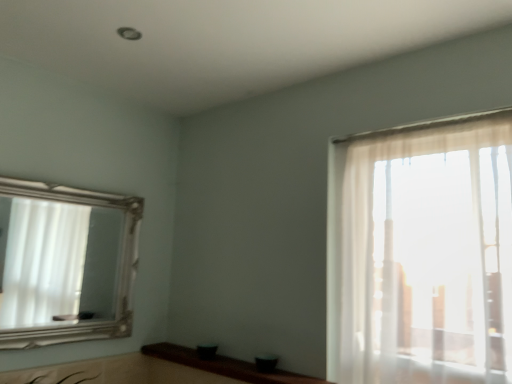
Measure the distance between point [253,374] and camera.

Point [253,374] is 1.66 meters from camera.

Describe the element at coordinates (225, 366) in the screenshot. I see `brown wood counter top at lower center` at that location.

You are a GUI agent. You are given a task and a screenshot of the screen. Output one action in this format:
    pyautogui.click(x=<x>, y=<y>)
    Task: Click on the brown wood counter top at lower center
    
    Given the screenshot: What is the action you would take?
    pyautogui.click(x=225, y=366)

In order to face silver/golden frame mirror at left, should I rotate leftwards or rightwards?

Turn left approximately 22.949 degrees to face it.

Describe the element at coordinates (57, 260) in the screenshot. I see `silver/golden frame mirror at left` at that location.

Image resolution: width=512 pixels, height=384 pixels. Find the location of `silver/golden frame mirror at left`. silver/golden frame mirror at left is located at coordinates (57, 260).

Measure the distance between silver/golden frame mirror at left and camera.

The distance of silver/golden frame mirror at left from camera is 2.51 meters.

Find the location of a particular element. brown wood counter top at lower center is located at coordinates click(x=225, y=366).

Which is more to the left, silver/golden frame mirror at left or brown wood counter top at lower center?

Positioned to the left is silver/golden frame mirror at left.

Relative to brown wood counter top at lower center, is silver/golden frame mirror at left in front or behind?

Clearly, silver/golden frame mirror at left is behind brown wood counter top at lower center.

Considering the points (108, 313) and (165, 349), which point is in front, point (108, 313) or point (165, 349)?

The point (165, 349) is in front.

Looking at this image, from the image's perspective, between silver/golden frame mirror at left and brown wood counter top at lower center, which one is located above?

silver/golden frame mirror at left.

From a real-world perspective, is silver/golden frame mirror at left on brown wood counter top at lower center?

Indeed, from a real-world perspective, silver/golden frame mirror at left stands above brown wood counter top at lower center.

Can you confirm if silver/golden frame mirror at left is wider than brown wood counter top at lower center?

Incorrect, the width of silver/golden frame mirror at left does not surpass that of brown wood counter top at lower center.

Considering the sizes of silver/golden frame mirror at left and brown wood counter top at lower center in the image, is silver/golden frame mirror at left taller or shorter than brown wood counter top at lower center?

In the image, silver/golden frame mirror at left appears to be taller than brown wood counter top at lower center.

Considering the relative sizes of silver/golden frame mirror at left and brown wood counter top at lower center in the image provided, is silver/golden frame mirror at left bigger than brown wood counter top at lower center?

Yes.

Looking at this image, is silver/golden frame mirror at left inside or outside of brown wood counter top at lower center?

silver/golden frame mirror at left is not enclosed by brown wood counter top at lower center.

Is silver/golden frame mirror at left far from brown wood counter top at lower center?

silver/golden frame mirror at left is far away from brown wood counter top at lower center.

Is silver/golden frame mirror at left positioned with its back to brown wood counter top at lower center?

No, silver/golden frame mirror at left's orientation is not away from brown wood counter top at lower center.

Can you tell me how much silver/golden frame mirror at left and brown wood counter top at lower center differ in facing direction?

There is a 89-degree angle between the facing directions of silver/golden frame mirror at left and brown wood counter top at lower center.

Where is `counter top lying in front of the silver/golden frame mirror at left`? The height and width of the screenshot is (384, 512). counter top lying in front of the silver/golden frame mirror at left is located at coordinates (225, 366).

Does brown wood counter top at lower center appear on the right side of silver/golden frame mirror at left?

Indeed, brown wood counter top at lower center is positioned on the right side of silver/golden frame mirror at left.

Between brown wood counter top at lower center and silver/golden frame mirror at left, which one is positioned in front?

brown wood counter top at lower center is more forward.

Is point (249, 375) behind point (61, 242)?

No.

From the image's perspective, is brown wood counter top at lower center located above silver/golden frame mirror at left?

Actually, brown wood counter top at lower center appears below silver/golden frame mirror at left in the image.

From a real-world perspective, is brown wood counter top at lower center above or below silver/golden frame mirror at left?

brown wood counter top at lower center is situated lower than silver/golden frame mirror at left in the real world.

In terms of width, does brown wood counter top at lower center look wider or thinner when compared to silver/golden frame mirror at left?

Considering their sizes, brown wood counter top at lower center looks broader than silver/golden frame mirror at left.

Can you confirm if brown wood counter top at lower center is shorter than silver/golden frame mirror at left?

Yes.

Considering the sizes of objects brown wood counter top at lower center and silver/golden frame mirror at left in the image provided, who is bigger, brown wood counter top at lower center or silver/golden frame mirror at left?

With larger size is silver/golden frame mirror at left.

Does brown wood counter top at lower center contain silver/golden frame mirror at left?

No, brown wood counter top at lower center does not contain silver/golden frame mirror at left.

Are brown wood counter top at lower center and silver/golden frame mirror at left making contact?

brown wood counter top at lower center and silver/golden frame mirror at left are clearly separated.

Is brown wood counter top at lower center oriented towards silver/golden frame mirror at left?

No, brown wood counter top at lower center does not turn towards silver/golden frame mirror at left.

How many degrees apart are the facing directions of brown wood counter top at lower center and silver/golden frame mirror at left?

brown wood counter top at lower center and silver/golden frame mirror at left are facing 89 degrees away from each other.

This screenshot has height=384, width=512. What are the coordinates of `counter top located in front of the silver/golden frame mirror at left` in the screenshot? It's located at tap(225, 366).

At what (x,y) coordinates should I click in order to perform the action: click on counter top that is under the silver/golden frame mirror at left (from a real-world perspective). Please return your answer as a coordinate pair (x, y). This screenshot has width=512, height=384. Looking at the image, I should click on (225, 366).

The width and height of the screenshot is (512, 384). Identify the location of mirror behind the brown wood counter top at lower center. (57, 260).